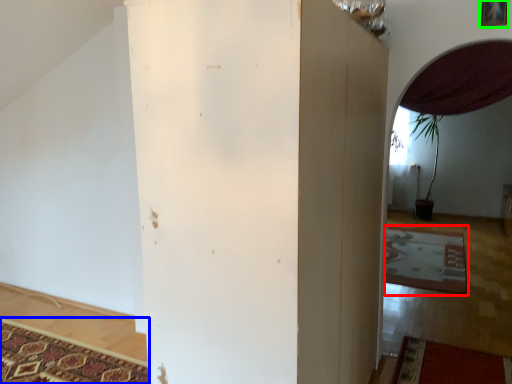
Question: Estimate the real-world distances between objects in this image. Which object is farther from mat (highlighted by a red box), mat (highlighted by a blue box) or picture frame (highlighted by a green box)?

Choices:
 (A) mat
 (B) picture frame

Answer: (A)